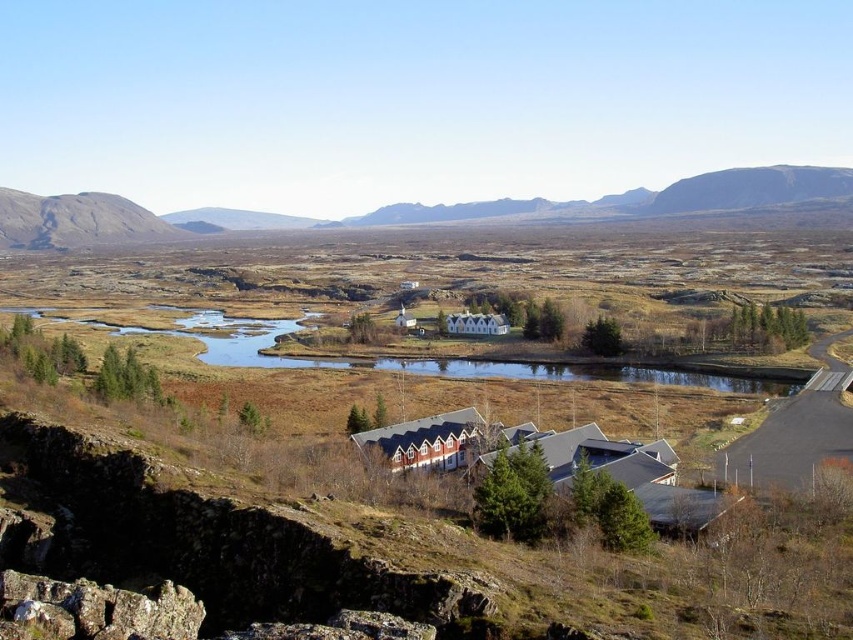
Based on the photo, does blue corrugated metal building at center have a lesser height compared to rugged rock mountain at left?

Yes.

Looking at this image, does blue corrugated metal building at center appear over rugged rock mountain at left?

No, blue corrugated metal building at center is not above rugged rock mountain at left.

Find the location of a particular element. Image resolution: width=853 pixels, height=640 pixels. blue corrugated metal building at center is located at coordinates (627, 474).

Who is positioned more to the left, green grassy lake at center or rugged rock mountain at left?

From the viewer's perspective, rugged rock mountain at left appears more on the left side.

Between green grassy lake at center and rugged rock mountain at left, which one appears on the right side from the viewer's perspective?

From the viewer's perspective, green grassy lake at center appears more on the right side.

Between point (230, 356) and point (71, 218), which one is positioned behind?

Point (71, 218)

At what (x,y) coordinates should I click in order to perform the action: click on green grassy lake at center. Please return your answer as a coordinate pair (x, y). The height and width of the screenshot is (640, 853). Looking at the image, I should click on (415, 358).

In the scene shown: Which is more to the right, blue corrugated metal building at center or green grassy lake at center?

Positioned to the right is blue corrugated metal building at center.

Is point (653, 465) positioned behind point (490, 365)?

No, it is not.

The height and width of the screenshot is (640, 853). Describe the element at coordinates (627, 474) in the screenshot. I see `blue corrugated metal building at center` at that location.

Identify the location of blue corrugated metal building at center. (627, 474).